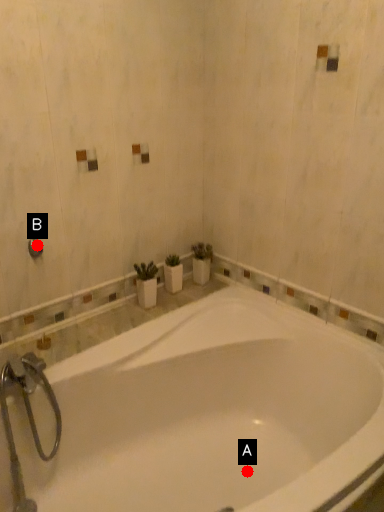
Question: Two points are circled on the image, labeled by A and B beside each circle. Which point appears farthest from the camera in this image?

Choices:
 (A) A is further
 (B) B is further

Answer: (A)